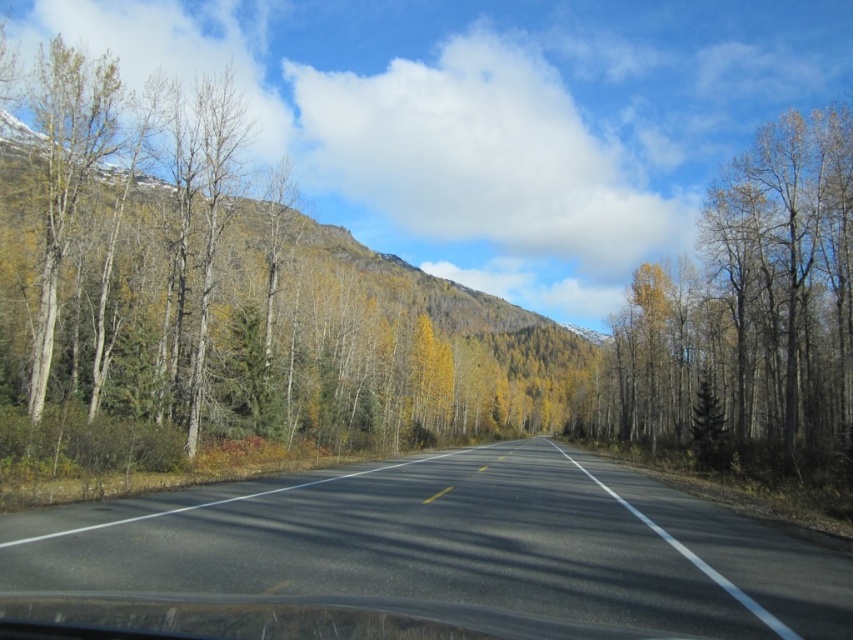
Question: Can you confirm if black asphalt road at center is positioned below yellow-green leaves at right?

Choices:
 (A) no
 (B) yes

Answer: (B)

Question: Among these objects, which one is nearest to the camera?

Choices:
 (A) black asphalt road at center
 (B) yellow-green leaves at right

Answer: (A)

Question: Does black asphalt road at center appear on the left side of yellow-green leaves at right?

Choices:
 (A) yes
 (B) no

Answer: (A)

Question: Is black asphalt road at center thinner than yellow-green leaves at right?

Choices:
 (A) yes
 (B) no

Answer: (B)